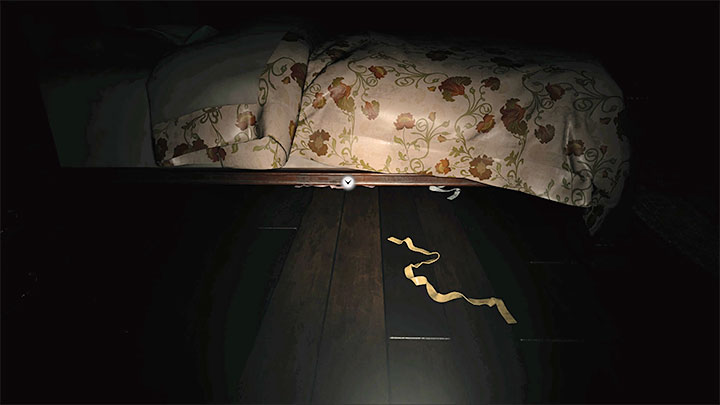
Find the location of a particular element. wood bed frame is located at coordinates (266, 176).